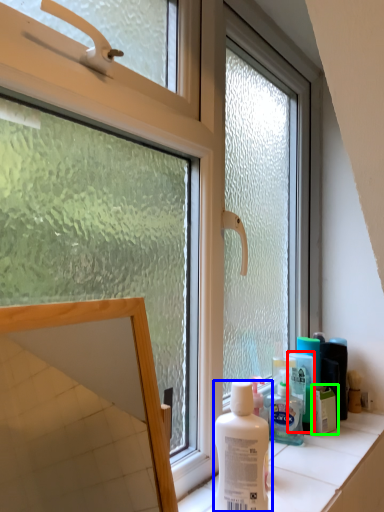
Question: Which is farther away from mouthwash (highlighted by a red box)? bottle (highlighted by a blue box) or product (highlighted by a green box)?

Choices:
 (A) bottle
 (B) product

Answer: (A)